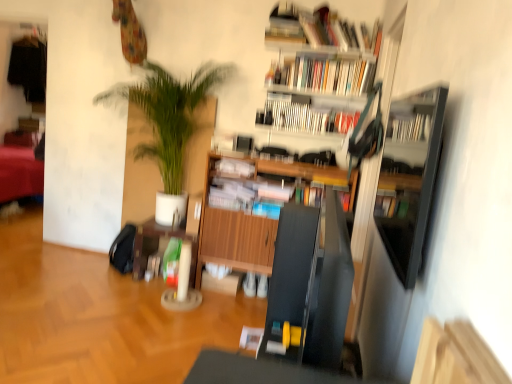
You are a GUI agent. You are given a task and a screenshot of the screen. Output one action in this format:
    pyautogui.click(x=<x>, y=<y>)
    Task: Click on the free point above hardcover book at upper center, which is counted as the 2th book, starting from the bottom (from a real-world perspective)
    Image resolution: width=512 pixels, height=384 pixels.
    Given the screenshot: What is the action you would take?
    pyautogui.click(x=313, y=107)